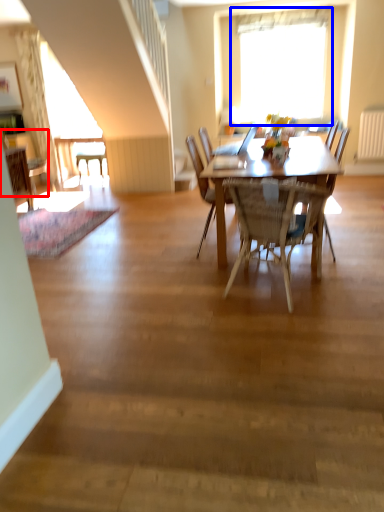
Question: Which of the following is the closest to the observer, chair (highlighted by a red box) or window (highlighted by a blue box)?

Choices:
 (A) chair
 (B) window

Answer: (A)